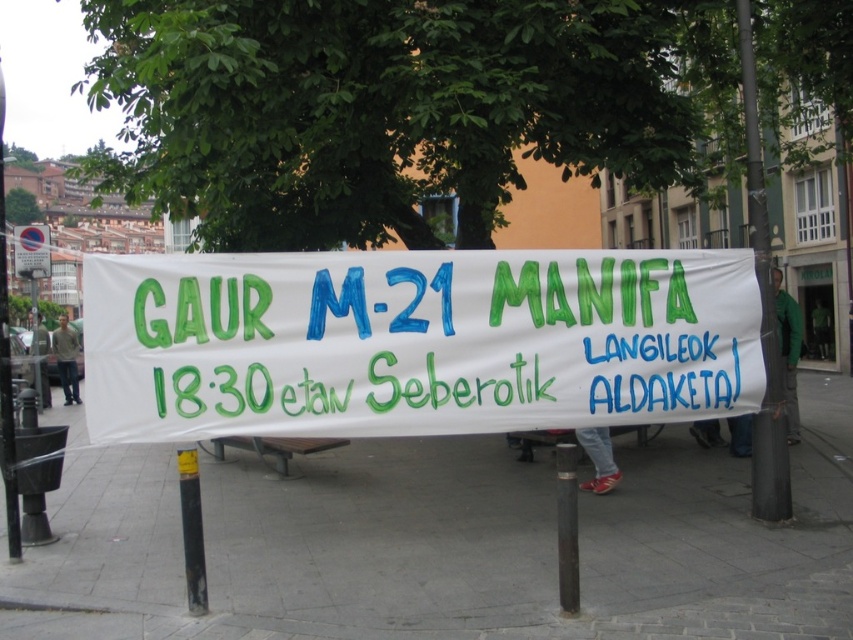
Question: Considering the relative positions of white paper banner at center and smooth gray pole at right in the image provided, where is white paper banner at center located with respect to smooth gray pole at right?

Choices:
 (A) above
 (B) below

Answer: (A)

Question: Which of the following is the farthest from the observer?

Choices:
 (A) (3, 397)
 (B) (26, 232)
 (C) (746, 109)

Answer: (B)

Question: Which object appears closest to the camera in this image?

Choices:
 (A) blue circular sign at upper left
 (B) brushed metal pole at left
 (C) smooth gray pole at right

Answer: (B)

Question: Is white paper banner at center wider than smooth gray pole at right?

Choices:
 (A) no
 (B) yes

Answer: (B)

Question: Is brushed metal pole at left further to the viewer compared to blue circular sign at upper left?

Choices:
 (A) no
 (B) yes

Answer: (A)

Question: Estimate the real-world distances between objects in this image. Which object is closer to the brushed metal pole at left?

Choices:
 (A) white concrete pavement at center
 (B) blue circular sign at upper left
 (C) smooth gray pole at right

Answer: (A)